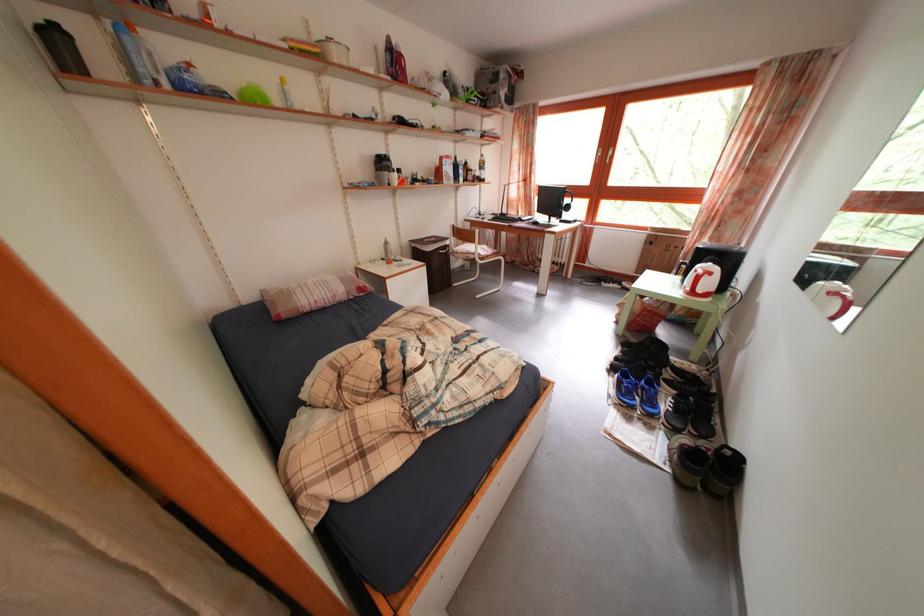
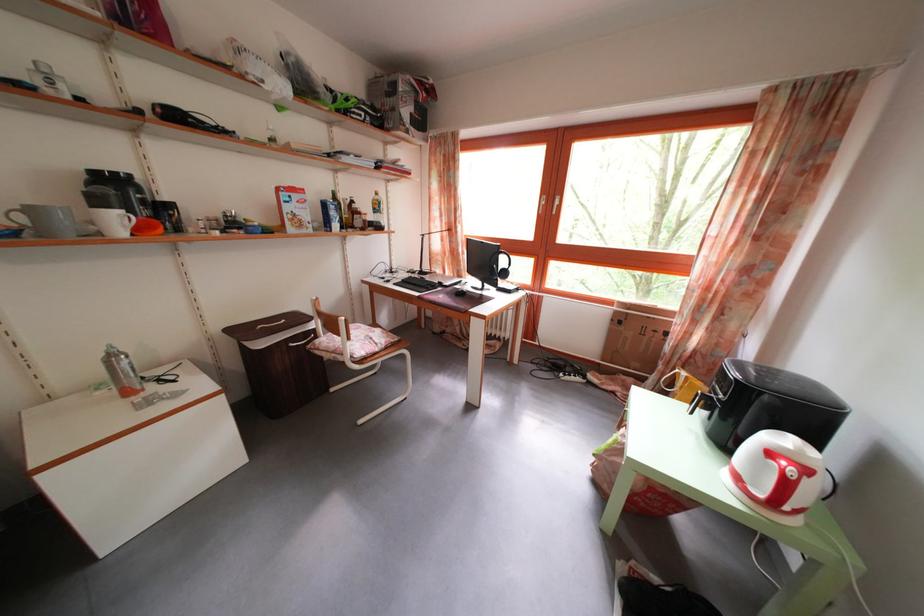
Question: I am providing you with two images of the same scene from different viewpoints. Which of the following objects are not visible in image2?

Choices:
 (A) black computer mouse
 (B) white kettle handle
 (C) red kettle switch
 (D) none of these

Answer: (D)